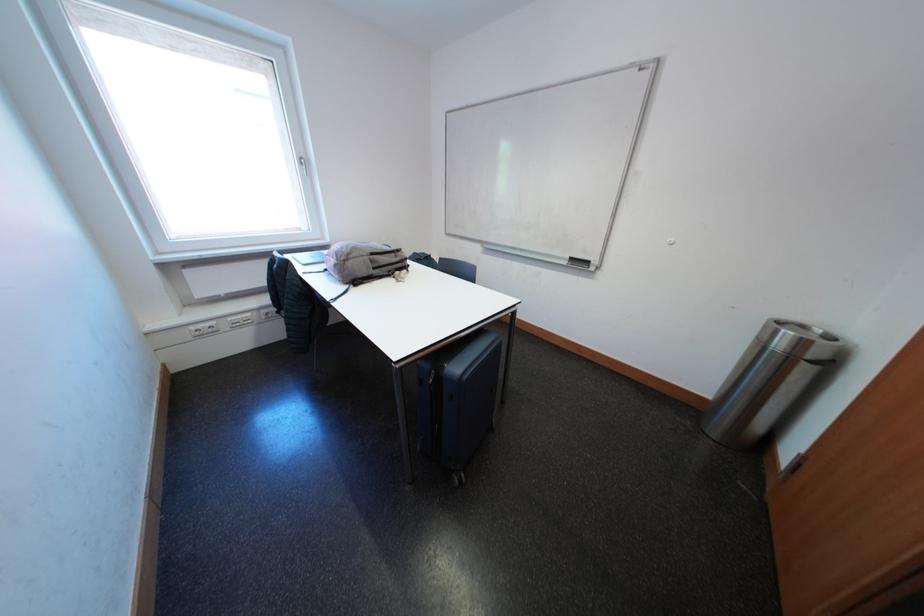
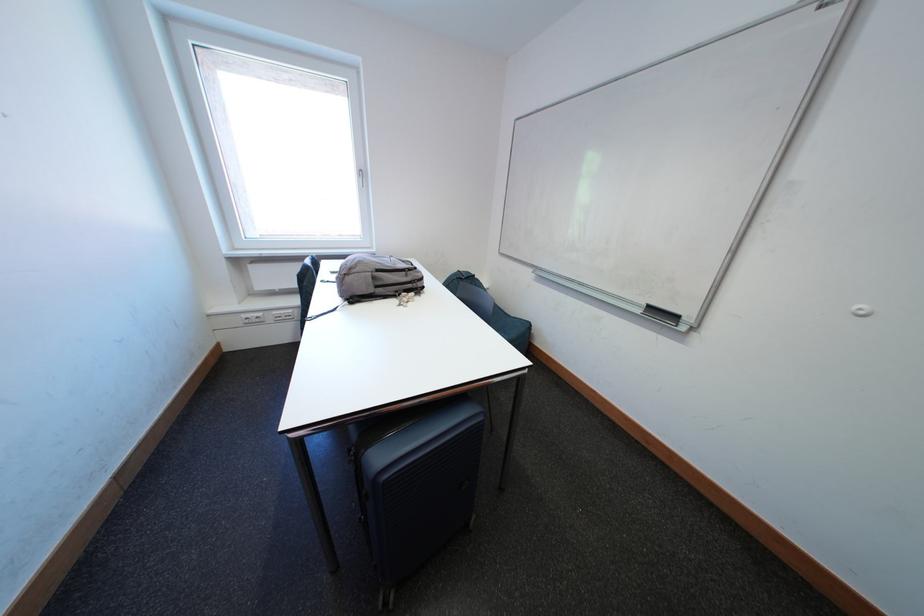
Where in the second image is the point corresponding to (202,331) from the first image?

(253, 320)